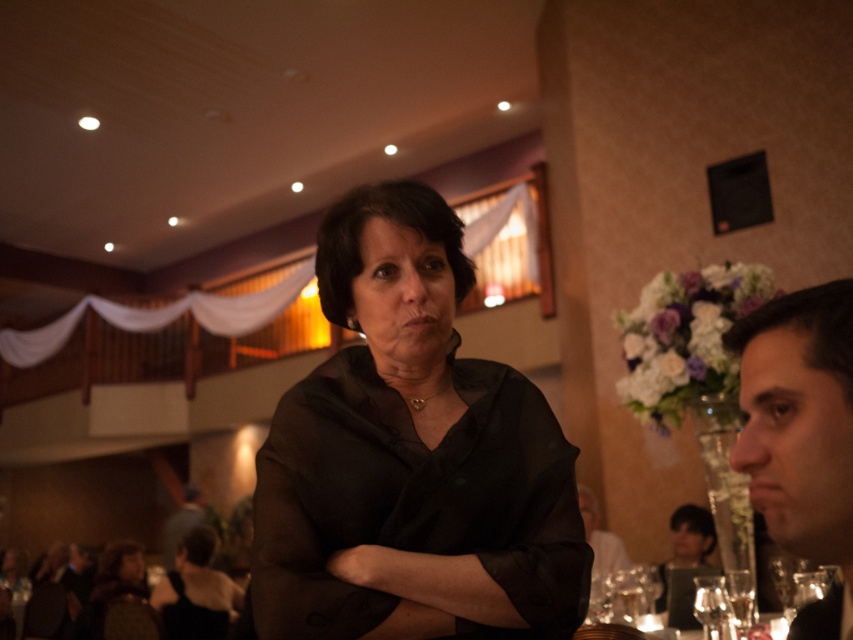
Question: Does dark brown fabric at lower left lie in front of smooth gray shirt at lower left?

Choices:
 (A) no
 (B) yes

Answer: (B)

Question: Which of these objects is positioned closest to the matte black dress at center?

Choices:
 (A) smooth black hair at right
 (B) matte black blouse at center
 (C) dark brown fabric at lower left

Answer: (B)

Question: Is dark brown fabric at lower left smaller than smooth gray shirt at lower left?

Choices:
 (A) yes
 (B) no

Answer: (A)

Question: Which is farther from the dark brown fabric at lower left?

Choices:
 (A) matte black dress at center
 (B) smooth gray shirt at lower left
 (C) smooth black hair at right
 (D) matte black blouse at center

Answer: (C)

Question: Does matte black blouse at center come in front of smooth black hair at right?

Choices:
 (A) yes
 (B) no

Answer: (B)

Question: Which point appears closest to the camera in this image?

Choices:
 (A) (186, 512)
 (B) (97, 600)
 (C) (657, 602)
 (D) (358, 301)

Answer: (D)